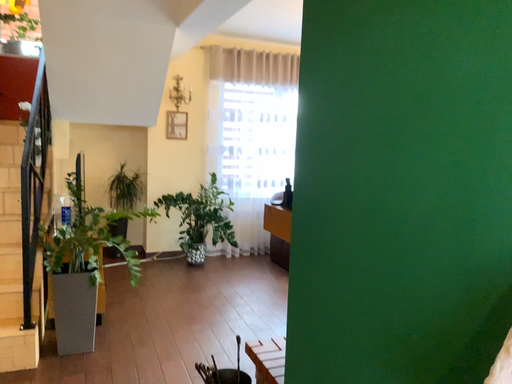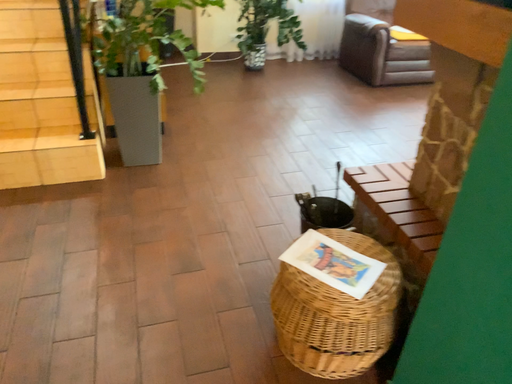
Question: Which way did the camera rotate in the video?

Choices:
 (A) rotated downward
 (B) rotated upward

Answer: (A)